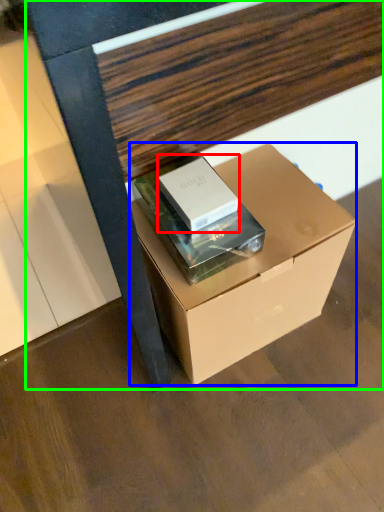
Question: Which object is positioned closest to box (highlighted by a red box)? Select from box (highlighted by a blue box) and furniture (highlighted by a green box).

Choices:
 (A) box
 (B) furniture

Answer: (A)